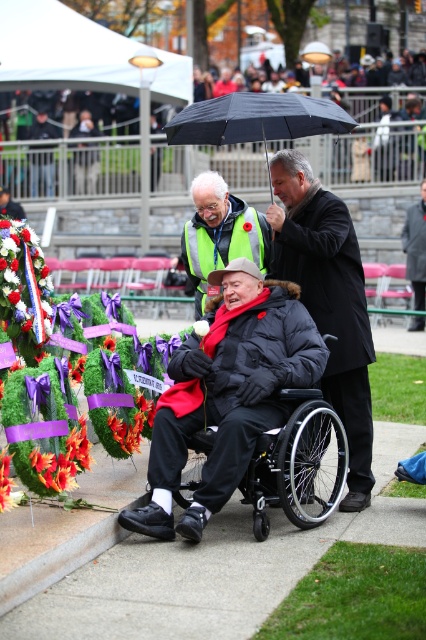
Who is shorter, black plastic wheelchair at center or dark gray coat at center?

black plastic wheelchair at center

Does point (310, 467) come farther from viewer compared to point (417, 252)?

No, it is in front of (417, 252).

Locate an element on the screen. This screenshot has height=640, width=426. black plastic wheelchair at center is located at coordinates (298, 464).

Which is behind, point (206, 259) or point (28, 340)?

Positioned behind is point (206, 259).

Which is more to the right, reflective silver vest at center or red silk ribbon at left?

From the viewer's perspective, reflective silver vest at center appears more on the right side.

Identify the location of reflective silver vest at center. This screenshot has width=426, height=640. (219, 234).

What are the coordinates of `reflective silver vest at center` in the screenshot? It's located at (219, 234).

Is black coat at center closer to the viewer compared to red silk ribbon at left?

Yes, black coat at center is closer to the viewer.

Between black coat at center and red silk ribbon at left, which one is positioned higher?

red silk ribbon at left is above.

Does point (325, 332) come behind point (8, 324)?

No, (325, 332) is in front of (8, 324).

Find the location of `black coat at center`. black coat at center is located at coordinates (328, 301).